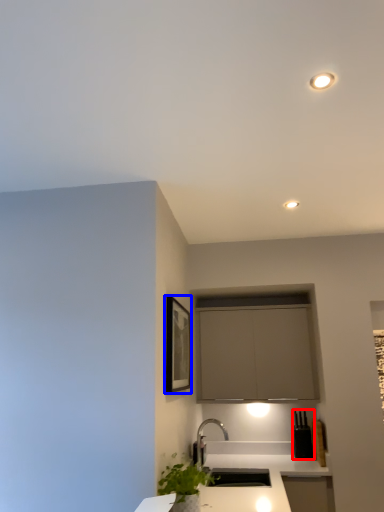
Question: Among these objects, which one is farthest to the camera, appliance (highlighted by a red box) or picture frame (highlighted by a blue box)?

Choices:
 (A) appliance
 (B) picture frame

Answer: (A)